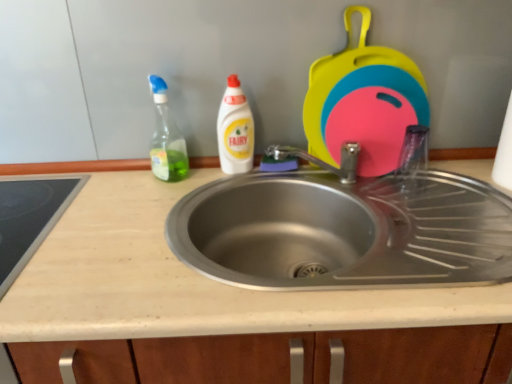
Question: Is beige laminate countertop at center spatially inside translucent plastic spray bottle at left, the first cleaning product when ordered from left to right, or outside of it?

Choices:
 (A) inside
 (B) outside

Answer: (B)

Question: In the image, is beige laminate countertop at center positioned in front of or behind translucent plastic spray bottle at left, the first cleaning product when ordered from left to right?

Choices:
 (A) front
 (B) behind

Answer: (A)

Question: Which of these objects is positioned closest to the white glossy bottle at center, the 2th cleaning product in the left-to-right sequence?

Choices:
 (A) rubberized plastic cutting boards at upper right, which appears as the first appliance when viewed from the right
 (B) smooth glass cooktop at left, the 1th appliance positioned from the left
 (C) beige laminate countertop at center
 (D) translucent plastic spray bottle at left, the first cleaning product when ordered from left to right

Answer: (D)

Question: Which object is positioned farthest from the beige laminate countertop at center?

Choices:
 (A) white glossy bottle at center, the 2th cleaning product in the left-to-right sequence
 (B) translucent plastic spray bottle at left, the second cleaning product from the right
 (C) rubberized plastic cutting boards at upper right, positioned as the 2th appliance in bottom-to-top order
 (D) smooth glass cooktop at left, the 1th appliance positioned from the left

Answer: (C)